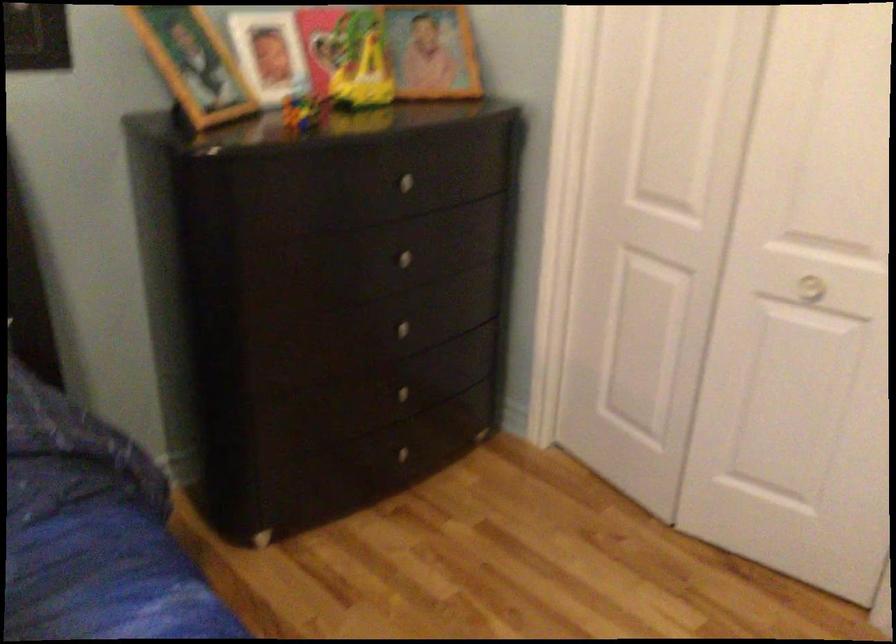
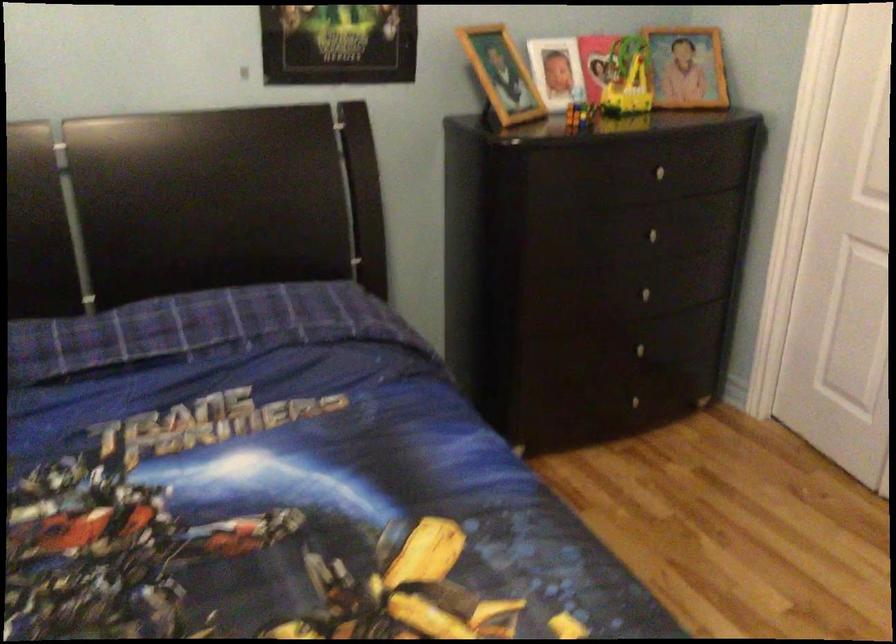
Question: In a continuous first-person perspective shot, in which direction is the camera moving?

Choices:
 (A) Left
 (B) Right
 (C) Forward
 (D) Backward

Answer: (D)